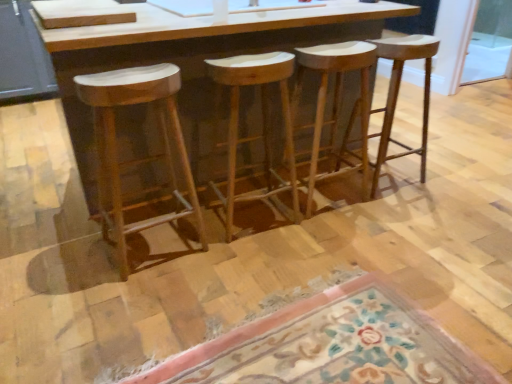
This screenshot has height=384, width=512. Find the location of `vacant space in front of transparent glass screen door at upper right`. vacant space in front of transparent glass screen door at upper right is located at coordinates (482, 95).